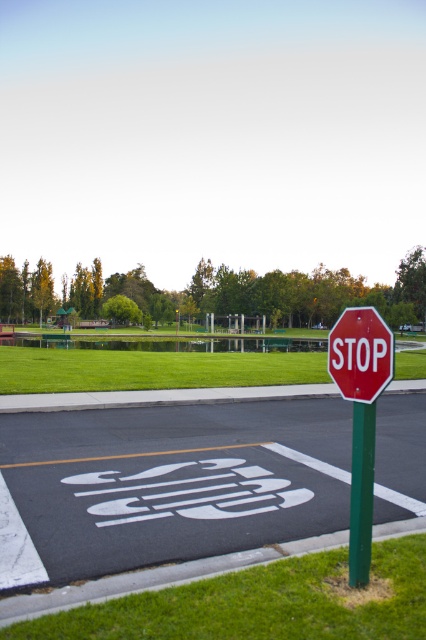
You are a pedestrian trying to cross the road and see the red matte stop sign at center and the green metallic pole at right. Which object is wider?

The red matte stop sign at center is wider than the green metallic pole at right.

Consider the image. You are a pedestrian standing at the edge of the road where the white painted stop sign at center is located. You need to cross the road safely. Based on the stop sign position, where should you position yourself relative to the stop sign to ensure you can see oncoming traffic clearly?

The white painted stop sign at center is located at point (x=169, y=483), so positioning yourself to the side of the stop sign would allow you to see oncoming traffic clearly without obstruction.

You are a gardener who needs to mow the lawn. You observe the green grass at lower center and the green grass at center. Which area requires mowing first based on their height?

The green grass at lower center requires mowing first because it has a lesser height compared to the green grass at center, so it needs attention sooner to maintain uniformity.